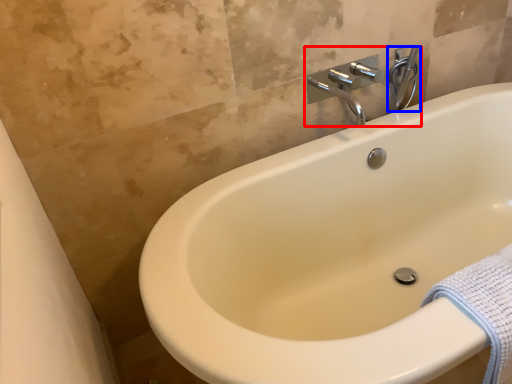
Question: Which of the following is the farthest to the observer, tap (highlighted by a red box) or plumbing fixture (highlighted by a blue box)?

Choices:
 (A) tap
 (B) plumbing fixture

Answer: (B)